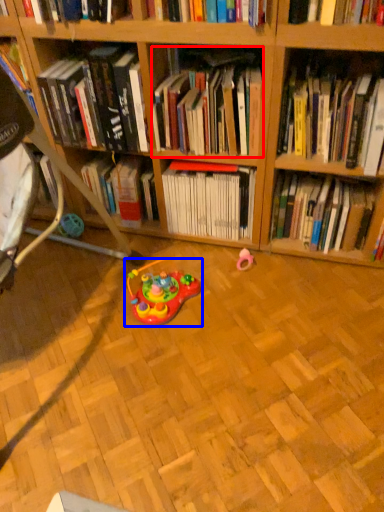
Question: Which object appears farthest to the camera in this image, book (highlighted by a red box) or toy (highlighted by a blue box)?

Choices:
 (A) book
 (B) toy

Answer: (B)